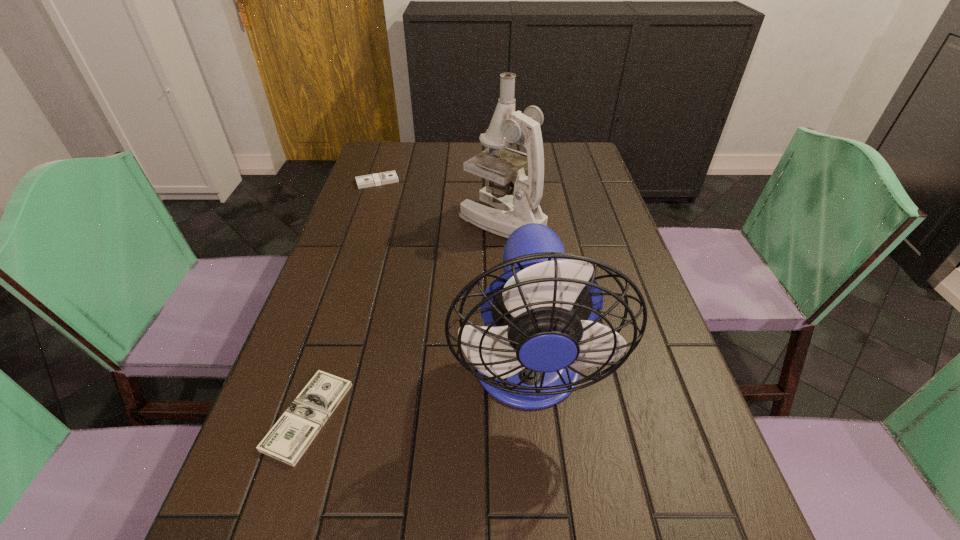
At what (x,y) coordinates should I click in order to perform the action: click on free space between the microscope and the nearer dollar. Please return your answer as a coordinate pair (x, y). The image size is (960, 540). Looking at the image, I should click on pyautogui.click(x=405, y=318).

You are a GUI agent. You are given a task and a screenshot of the screen. Output one action in this format:
    pyautogui.click(x=<x>, y=<y>)
    Task: Click on the vacant space in between the third tallest object and the third nearest object
    The width and height of the screenshot is (960, 540).
    Given the screenshot: What is the action you would take?
    pyautogui.click(x=440, y=201)

Identify the location of vacant area that lies between the third tallest object and the shorter dollar. Image resolution: width=960 pixels, height=540 pixels. (343, 299).

Locate an element on the screen. free area in between the fan and the farthest object is located at coordinates (453, 278).

Find the location of a particular element. the closest object relative to the fan is located at coordinates (288, 439).

Where is `object that is the third closest to the shorter dollar`? This screenshot has width=960, height=540. object that is the third closest to the shorter dollar is located at coordinates (389, 177).

Image resolution: width=960 pixels, height=540 pixels. I want to click on blank area in the image that satisfies the following two spatial constraints: 1. on the front side of the microscope; 2. on the right side of the taller dollar, so click(364, 220).